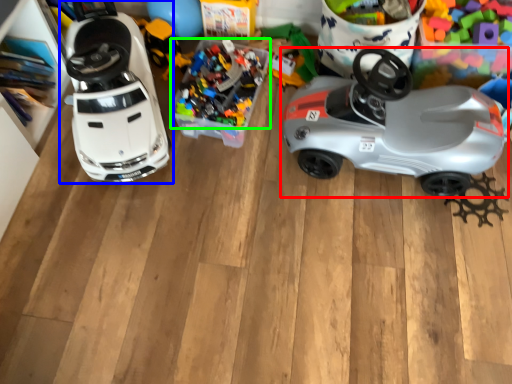
Question: Which object is the farthest from car (highlighted by a red box)? Choose among these: toy (highlighted by a blue box) or toy (highlighted by a green box).

Choices:
 (A) toy
 (B) toy

Answer: (A)